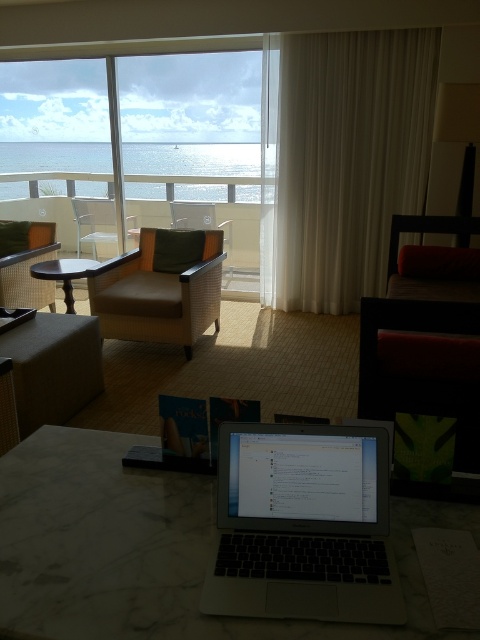
Question: Where is matte woven armchair at center located in relation to beige fabric armchair at center in the image?

Choices:
 (A) right
 (B) left

Answer: (A)

Question: Can you confirm if white sheer curtain at right is wider than matte beige armchair at left?

Choices:
 (A) yes
 (B) no

Answer: (A)

Question: Which object is farther from the camera taking this photo?

Choices:
 (A) matte beige armchair at left
 (B) matte brown armchair at center

Answer: (B)

Question: Which point is closer to the camera?

Choices:
 (A) matte woven armchair at center
 (B) white marble table at center
 (C) silver metallic laptop at center

Answer: (B)

Question: Observing the image, what is the correct spatial positioning of matte beige armchair at left in reference to beige fabric armchair at center?

Choices:
 (A) below
 (B) above

Answer: (A)

Question: Which point is farther to the camera?

Choices:
 (A) white marble table at center
 (B) silver metallic laptop at center
 (C) matte woven armchair at center
 (D) transparent glass window at upper left

Answer: (D)